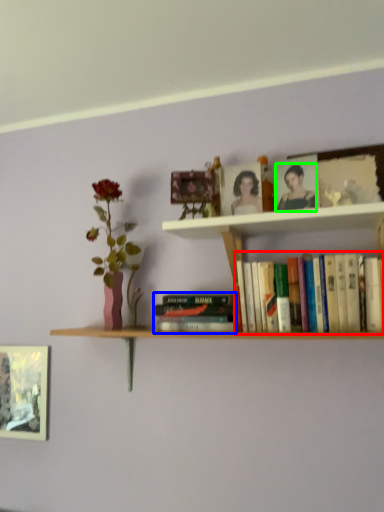
Question: Considering the real-world distances, which object is farthest from book (highlighted by a red box)? book (highlighted by a blue box) or person (highlighted by a green box)?

Choices:
 (A) book
 (B) person

Answer: (B)